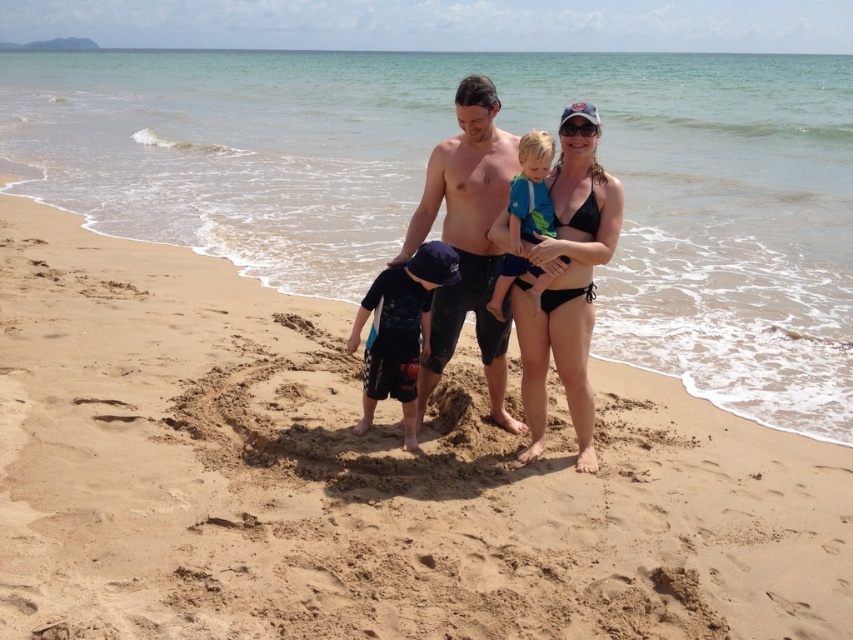
Question: Which object appears closest to the camera in this image?

Choices:
 (A) black plastic goggles at center
 (B) shiny skin man at center
 (C) blue fabric shirt at center

Answer: (A)

Question: Which is nearer to the brown sandy beach at center?

Choices:
 (A) black plastic goggles at center
 (B) shiny skin man at center

Answer: (B)

Question: Based on their relative distances, which object is farther from the brown sandy beach at center?

Choices:
 (A) dark blue fabric shorts at center
 (B) matte black swimwear at center
 (C) blue fabric shirt at center
 (D) shiny skin man at center

Answer: (C)

Question: Is matte black swimwear at center wider than blue fabric shirt at center?

Choices:
 (A) no
 (B) yes

Answer: (B)

Question: Is brown sandy beach at center positioned at the back of black plastic goggles at center?

Choices:
 (A) no
 (B) yes

Answer: (B)

Question: Observing the image, what is the correct spatial positioning of matte black swimwear at center in reference to black plastic goggles at center?

Choices:
 (A) above
 (B) below

Answer: (B)